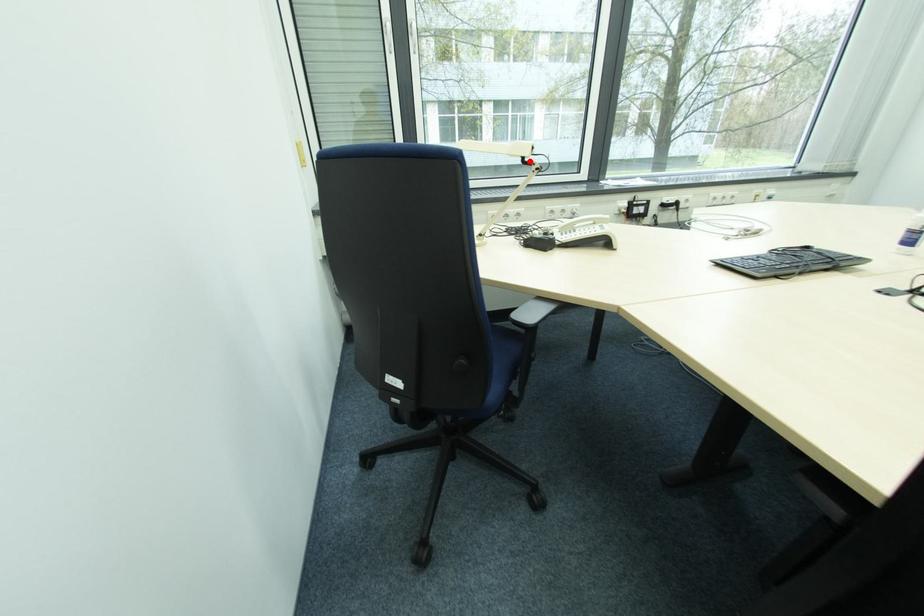
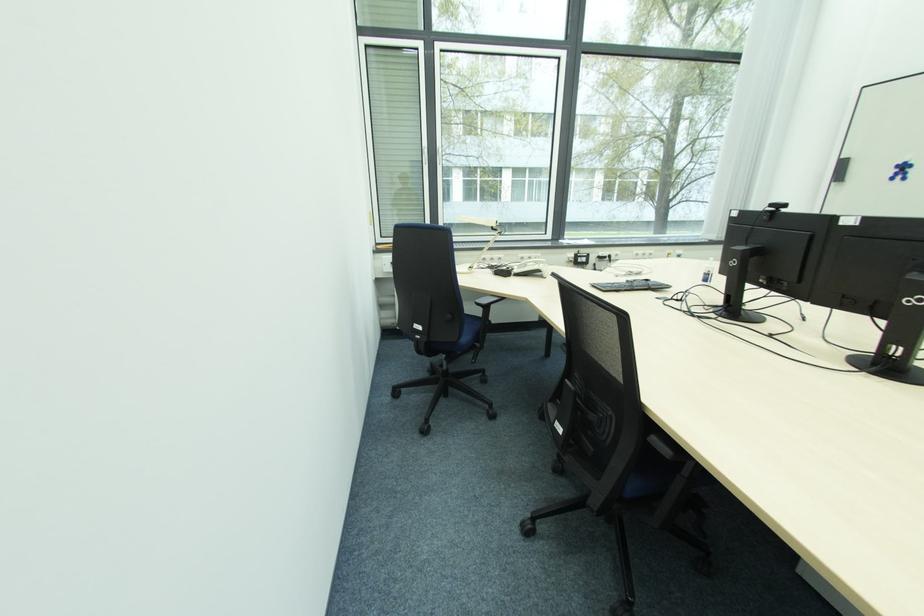
Where in the second image is the point corresponding to the highlighted location from the first image?

(497, 230)